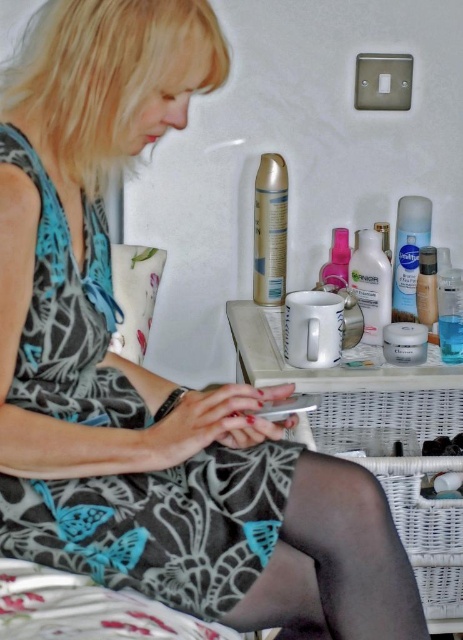
Question: Is white glossy lotion at center closer to camera compared to matte plastic foundation at center?

Choices:
 (A) no
 (B) yes

Answer: (B)

Question: Which point is farther to the camera?

Choices:
 (A) pink plastic bottle at upper center
 (B) matte plastic spray can at upper right

Answer: (B)

Question: Does silver metallic spray can at upper center have a lesser width compared to matte plastic foundation at center?

Choices:
 (A) yes
 (B) no

Answer: (B)

Question: Can you confirm if black tights at lower center is bigger than pink plastic bottle at upper center?

Choices:
 (A) no
 (B) yes

Answer: (B)

Question: Based on their relative distances, which object is farther from the matte plastic foundation at center?

Choices:
 (A) matte plastic spray can at upper right
 (B) white glossy lotion at center
 (C) silver metallic spray can at upper center
 (D) printed fabric dress at center

Answer: (D)

Question: Which of the following is the closest to the observer?

Choices:
 (A) 435,253
 (B) 257,280
 (C) 365,272

Answer: (C)